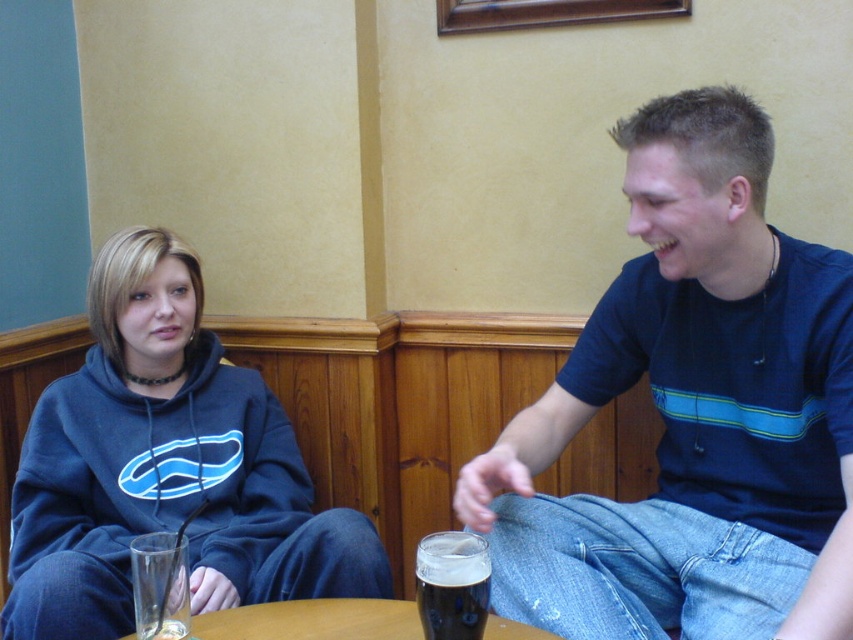
Can you confirm if blue cotton t-shirt at right is positioned below dark matte beer at lower center?

Actually, blue cotton t-shirt at right is above dark matte beer at lower center.

Does blue cotton t-shirt at right have a lesser width compared to dark matte beer at lower center?

In fact, blue cotton t-shirt at right might be wider than dark matte beer at lower center.

Which is behind, point (729, 257) or point (444, 557)?

Point (729, 257)

Where is `blue cotton t-shirt at right`? blue cotton t-shirt at right is located at coordinates (693, 412).

Does wooden table at center have a lesser height compared to clear glass at lower left?

Correct, wooden table at center is not as tall as clear glass at lower left.

Can you confirm if wooden table at center is bigger than clear glass at lower left?

Yes.

Image resolution: width=853 pixels, height=640 pixels. What do you see at coordinates (312, 620) in the screenshot?
I see `wooden table at center` at bounding box center [312, 620].

At what (x,y) coordinates should I click in order to perform the action: click on wooden table at center. Please return your answer as a coordinate pair (x, y). Looking at the image, I should click on (312, 620).

Describe the element at coordinates (312, 620) in the screenshot. This screenshot has height=640, width=853. I see `wooden table at center` at that location.

Does wooden table at center have a greater width compared to dark matte beer at lower center?

Correct, the width of wooden table at center exceeds that of dark matte beer at lower center.

Where is `wooden table at center`? wooden table at center is located at coordinates (312, 620).

At what (x,y) coordinates should I click in order to perform the action: click on wooden table at center. Please return your answer as a coordinate pair (x, y). This screenshot has width=853, height=640. Looking at the image, I should click on (312, 620).